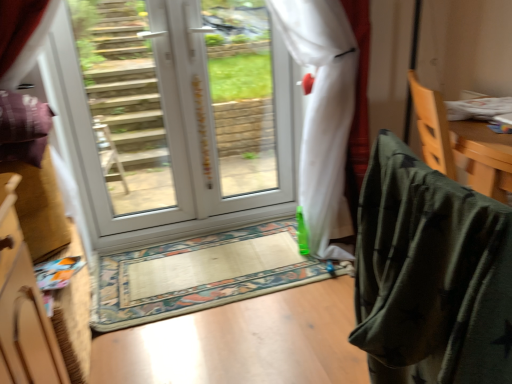
Question: Considering the relative sizes of transparent plastic window screen at center and white glossy door at center in the image provided, is transparent plastic window screen at center bigger than white glossy door at center?

Choices:
 (A) no
 (B) yes

Answer: (A)

Question: Considering the relative sizes of transparent plastic window screen at center and white glossy door at center in the image provided, is transparent plastic window screen at center shorter than white glossy door at center?

Choices:
 (A) no
 (B) yes

Answer: (B)

Question: Is transparent plastic window screen at center not inside white glossy door at center?

Choices:
 (A) yes
 (B) no

Answer: (B)

Question: Is white glossy door at center at the back of transparent plastic window screen at center?

Choices:
 (A) no
 (B) yes

Answer: (B)

Question: From the image's perspective, is transparent plastic window screen at center above white glossy door at center?

Choices:
 (A) no
 (B) yes

Answer: (B)

Question: From a real-world perspective, is wooden cabinet at left physically located above or below camouflage fabric bag at right?

Choices:
 (A) below
 (B) above

Answer: (A)

Question: From the image's perspective, relative to camouflage fabric bag at right, is wooden cabinet at left above or below?

Choices:
 (A) below
 (B) above

Answer: (A)

Question: Visually, is wooden cabinet at left positioned to the left or to the right of camouflage fabric bag at right?

Choices:
 (A) left
 (B) right

Answer: (A)

Question: Considering their positions, is wooden cabinet at left located in front of or behind camouflage fabric bag at right?

Choices:
 (A) front
 (B) behind

Answer: (B)

Question: From their relative heights in the image, would you say white glossy glass door at upper center is taller or shorter than transparent plastic window screen at center?

Choices:
 (A) short
 (B) tall

Answer: (B)

Question: Do you think white glossy glass door at upper center is within transparent plastic window screen at center, or outside of it?

Choices:
 (A) outside
 (B) inside

Answer: (A)

Question: Considering their positions, is white glossy glass door at upper center located in front of or behind transparent plastic window screen at center?

Choices:
 (A) behind
 (B) front

Answer: (B)

Question: Is white glossy glass door at upper center wider or thinner than transparent plastic window screen at center?

Choices:
 (A) wide
 (B) thin

Answer: (A)

Question: Is beige fabric doormat at center in front of or behind transparent plastic window screen at center in the image?

Choices:
 (A) front
 (B) behind

Answer: (A)

Question: Considering the positions of beige fabric doormat at center and transparent plastic window screen at center in the image, is beige fabric doormat at center taller or shorter than transparent plastic window screen at center?

Choices:
 (A) tall
 (B) short

Answer: (B)